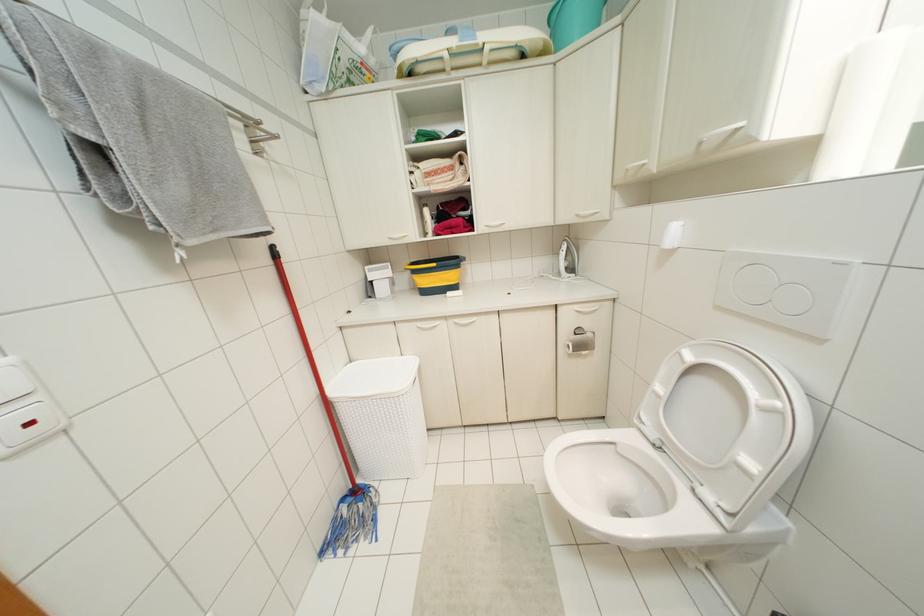
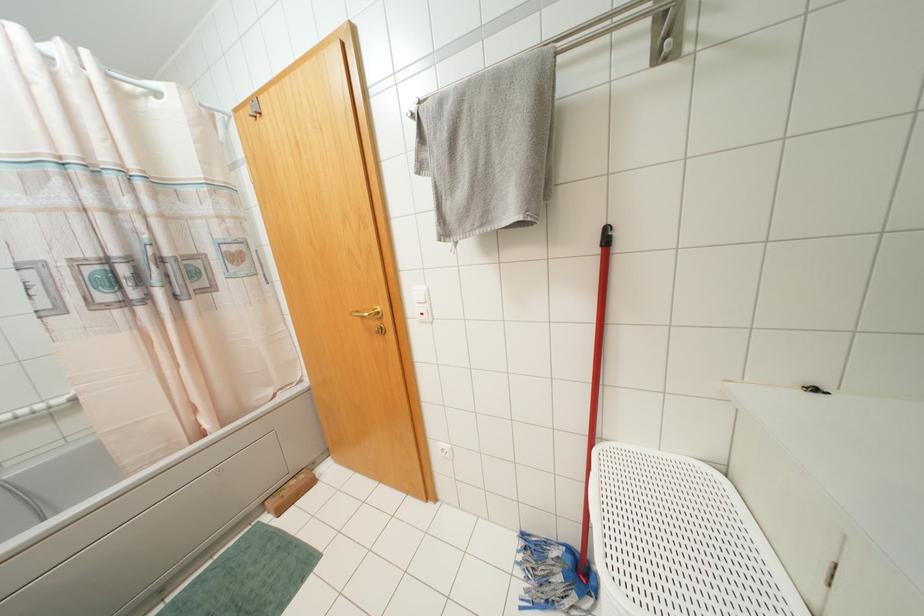
Locate, in the second image, the point that corresponds to the point at 214,230 in the first image.

(481, 225)